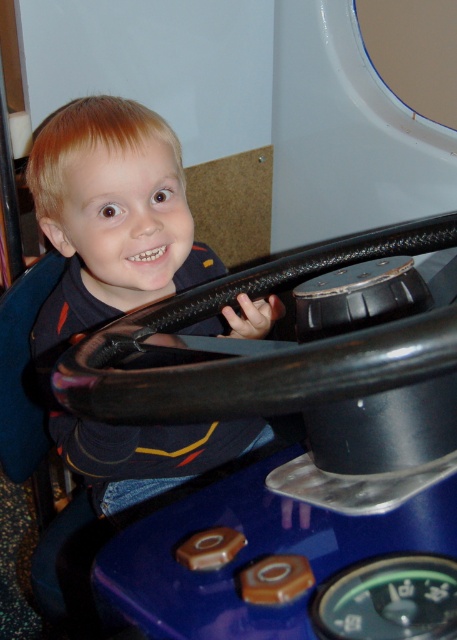
Is black leather steering wheel at center to the left of brown plastic button at center from the viewer's perspective?

In fact, black leather steering wheel at center is to the right of brown plastic button at center.

Does black leather steering wheel at center come behind brown plastic button at center?

No, black leather steering wheel at center is closer to the viewer.

Image resolution: width=457 pixels, height=640 pixels. I want to click on black leather steering wheel at center, so click(x=265, y=356).

Is point (149, 211) behind point (439, 240)?

No, (149, 211) is closer to viewer.

Which is more to the right, matte black steering wheel at center or black leather steering wheel at center?

black leather steering wheel at center is more to the right.

Locate an element on the screen. Image resolution: width=457 pixels, height=640 pixels. matte black steering wheel at center is located at coordinates (111, 218).

Who is shorter, matte black steering wheel at center or brown plastic button at center?

Standing shorter between the two is brown plastic button at center.

Does matte black steering wheel at center appear over brown plastic button at center?

Yes.

Between point (143, 294) and point (219, 548), which one is positioned behind?

Positioned behind is point (143, 294).

Where is `matte black steering wheel at center`? Image resolution: width=457 pixels, height=640 pixels. matte black steering wheel at center is located at coordinates (111, 218).